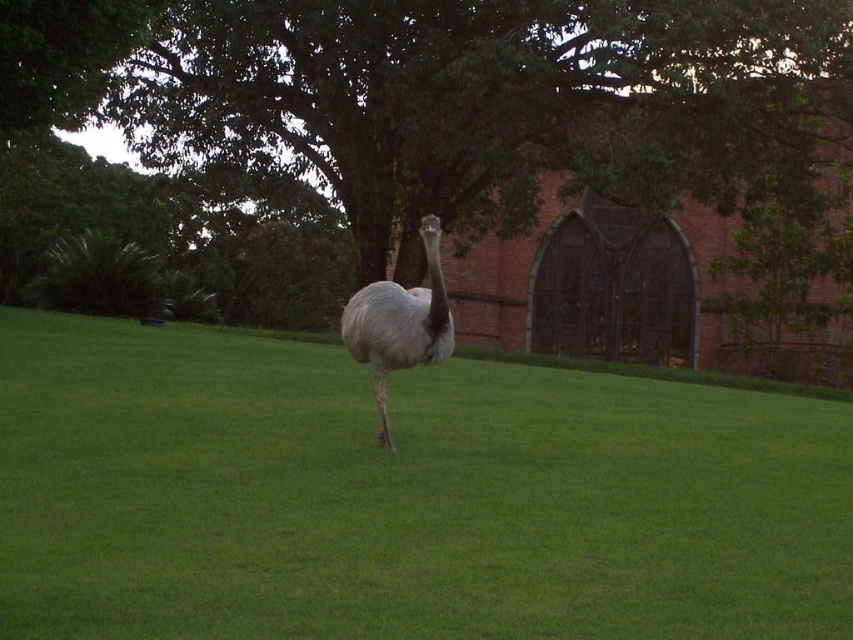
Between point (648, 602) and point (363, 333), which one is positioned in front?

Point (648, 602) is in front.

Locate an element on the screen. green grass at center is located at coordinates (401, 497).

Who is more forward, [4,378] or [378,371]?

Positioned in front is point [378,371].

This screenshot has width=853, height=640. I want to click on green grass at center, so coord(401,497).

Does green leafy tree at center have a greater height compared to gray feathered ostrich at center?

Yes.

Who is shorter, green leafy tree at center or gray feathered ostrich at center?

gray feathered ostrich at center is shorter.

Where is `green leafy tree at center`? The width and height of the screenshot is (853, 640). green leafy tree at center is located at coordinates (450, 97).

Locate an element on the screen. This screenshot has width=853, height=640. green leafy tree at center is located at coordinates 450,97.

Can you confirm if green grass at center is positioned to the right of green leafy tree at center?

Incorrect, green grass at center is not on the right side of green leafy tree at center.

Can you confirm if green grass at center is positioned to the left of green leafy tree at center?

Answer: Yes, green grass at center is to the left of green leafy tree at center.

Who is more forward, (676, 432) or (564, 154)?

Point (676, 432) is in front.

Where is `green grass at center`? The image size is (853, 640). green grass at center is located at coordinates (401, 497).